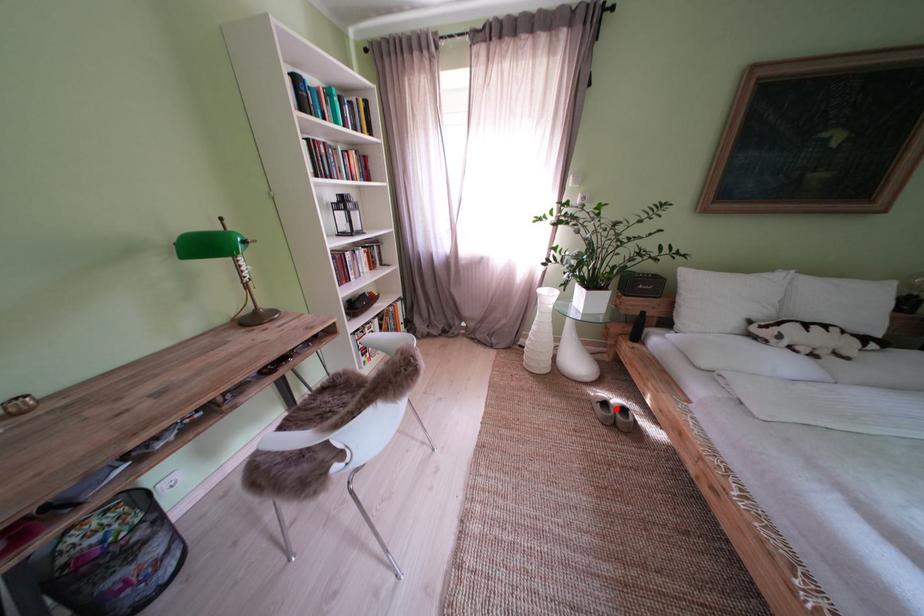
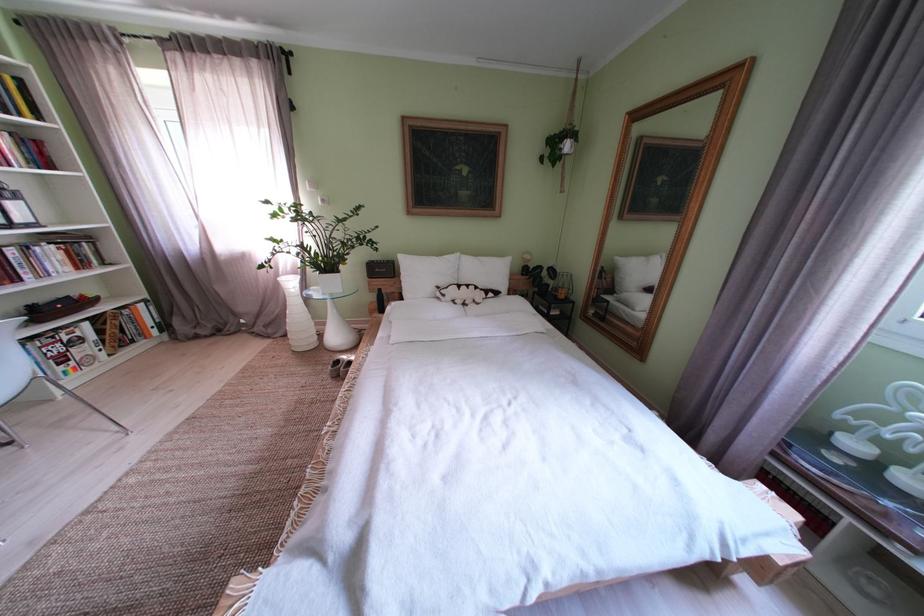
Locate, in the second image, the point that corresponds to the highlighted location in the first image.

(348, 367)